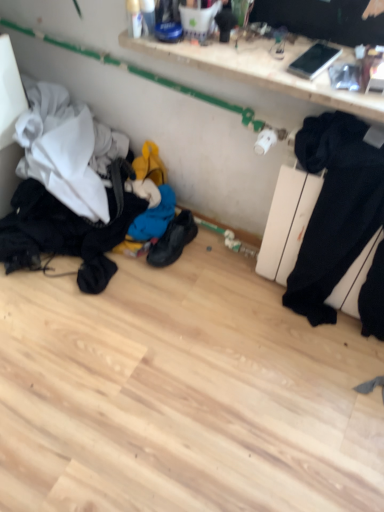
Find the location of `empty space that is to the right of black fabric laundry at lower left`. empty space that is to the right of black fabric laundry at lower left is located at coordinates (215, 298).